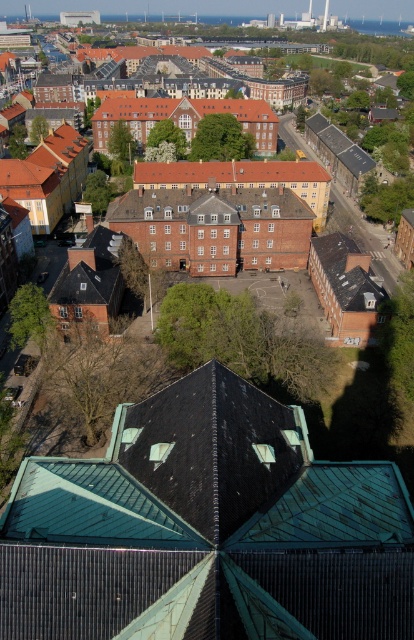
You are a drone operator trying to capture a photo of the brown brick building at center and the red tile roof at center. From your aerial view, which building is located to the left of the other?

The brown brick building at center is positioned on the right side of red tile roof at center, so the red tile roof at center is to the left of the brown brick building at center.